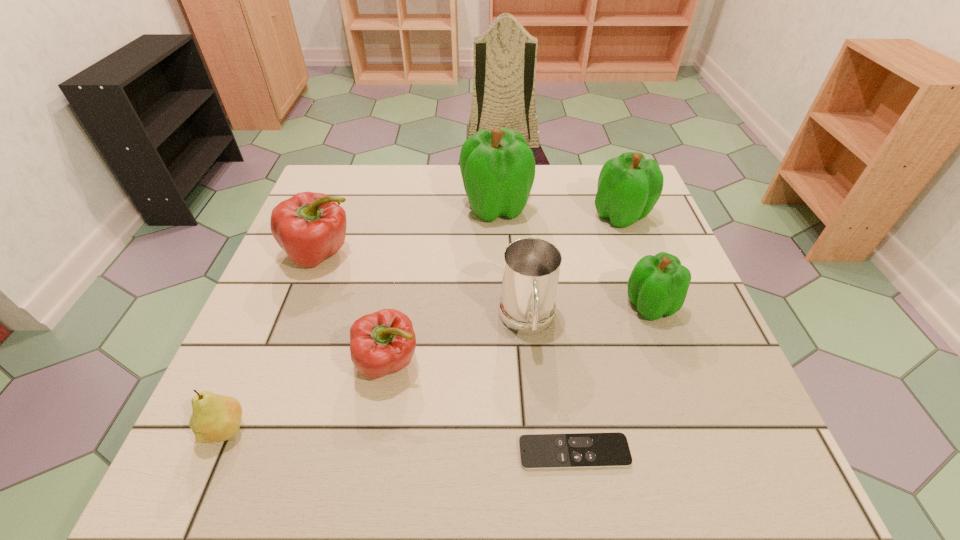
Find the location of a particular element. This screenshot has height=540, width=960. pear is located at coordinates (215, 417).

Identify the location of remote control. (578, 450).

At what (x,y) coordinates should I click in order to perform the action: click on the shortest object. Please return your answer as a coordinate pair (x, y). The width and height of the screenshot is (960, 540). Looking at the image, I should click on (578, 450).

Where is `vacant space located 0.070m on the back of the leftmost green bell pepper`? vacant space located 0.070m on the back of the leftmost green bell pepper is located at coordinates tap(494, 174).

This screenshot has height=540, width=960. I want to click on vacant area situated on the front of the second biggest green bell pepper, so point(651,295).

At what (x,y) coordinates should I click in order to perform the action: click on vacant space located on the back of the left pink bell pepper. Please return your answer as a coordinate pair (x, y). Image resolution: width=960 pixels, height=540 pixels. Looking at the image, I should click on (334, 219).

Locate an element on the screen. This screenshot has width=960, height=540. blank area located on the side of the gray mug with the handle is located at coordinates (543, 483).

This screenshot has width=960, height=540. I want to click on free point located 0.080m on the front of the second nearest bell pepper, so click(669, 359).

The image size is (960, 540). I want to click on vacant space located on the front of the second bell pepper from left to right, so point(370,469).

The width and height of the screenshot is (960, 540). I want to click on free spot located on the front of the pear, so click(x=200, y=489).